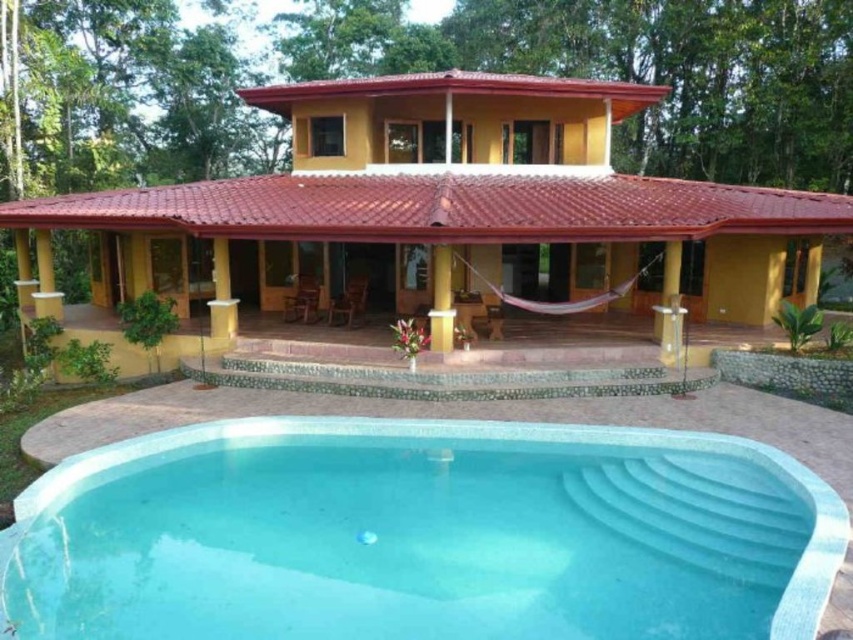
Question: Does smooth concrete pool at lower center have a larger size compared to purple fabric hammock at center?

Choices:
 (A) no
 (B) yes

Answer: (A)

Question: Which object is the farthest from the smooth concrete pool at lower center?

Choices:
 (A) purple fabric hammock at center
 (B) yellow wood pillar at center

Answer: (B)

Question: Which point is farther to the camera?

Choices:
 (A) pyautogui.click(x=556, y=305)
 (B) pyautogui.click(x=450, y=256)

Answer: (A)

Question: Which point appears farthest from the camera in this image?

Choices:
 (A) (548, 314)
 (B) (433, 296)

Answer: (B)

Question: Does smooth concrete pool at lower center appear under purple fabric hammock at center?

Choices:
 (A) no
 (B) yes

Answer: (B)

Question: Does smooth concrete pool at lower center have a lesser width compared to yellow wood pillar at center?

Choices:
 (A) no
 (B) yes

Answer: (B)